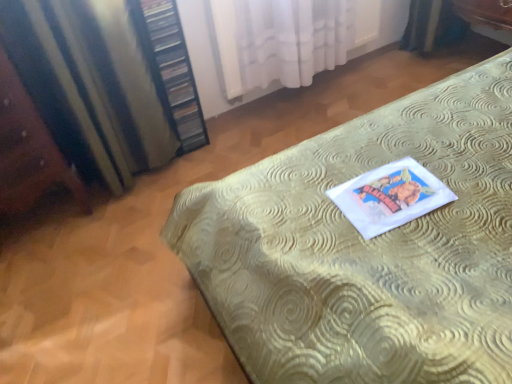
Question: From the image's perspective, does wooden bookshelf at left appear higher than white sheer curtain at upper center, which is the second curtain from left to right?

Choices:
 (A) yes
 (B) no

Answer: (B)

Question: Is white sheer curtain at upper center, which is the second curtain from left to right, located within wooden bookshelf at left?

Choices:
 (A) no
 (B) yes

Answer: (A)

Question: From a real-world perspective, is wooden bookshelf at left physically below white sheer curtain at upper center, which is the second curtain from left to right?

Choices:
 (A) yes
 (B) no

Answer: (B)

Question: Does wooden bookshelf at left have a smaller size compared to white sheer curtain at upper center, which is the second curtain from left to right?

Choices:
 (A) yes
 (B) no

Answer: (A)

Question: Is wooden bookshelf at left facing away from white sheer curtain at upper center, which appears as the 1th curtain when viewed from the right?

Choices:
 (A) no
 (B) yes

Answer: (A)

Question: From their relative heights in the image, would you say wooden bookshelf at left is taller or shorter than gold textured bed at center?

Choices:
 (A) tall
 (B) short

Answer: (B)

Question: In the image, is wooden bookshelf at left positioned in front of or behind gold textured bed at center?

Choices:
 (A) front
 (B) behind

Answer: (B)

Question: Is wooden bookshelf at left spatially inside gold textured bed at center, or outside of it?

Choices:
 (A) outside
 (B) inside

Answer: (A)

Question: From a real-world perspective, relative to gold textured bed at center, is wooden bookshelf at left vertically above or below?

Choices:
 (A) above
 (B) below

Answer: (B)

Question: Is white sheer curtain at upper center, which appears as the 1th curtain when viewed from the right, bigger or smaller than gold textured bed at center?

Choices:
 (A) big
 (B) small

Answer: (B)

Question: Is point (295, 76) positioned closer to the camera than point (448, 99)?

Choices:
 (A) farther
 (B) closer

Answer: (A)

Question: Is white sheer curtain at upper center, which appears as the 1th curtain when viewed from the right, in front of or behind gold textured bed at center in the image?

Choices:
 (A) front
 (B) behind

Answer: (B)

Question: Based on their positions, is white sheer curtain at upper center, which appears as the 1th curtain when viewed from the right, located to the left or right of gold textured bed at center?

Choices:
 (A) right
 (B) left

Answer: (B)

Question: Is point (95, 23) positioned closer to the camera than point (184, 97)?

Choices:
 (A) closer
 (B) farther

Answer: (A)

Question: From the image's perspective, is satin striped curtain at left, positioned as the second curtain in right-to-left order, located above or below wooden bookshelf at left?

Choices:
 (A) below
 (B) above

Answer: (A)